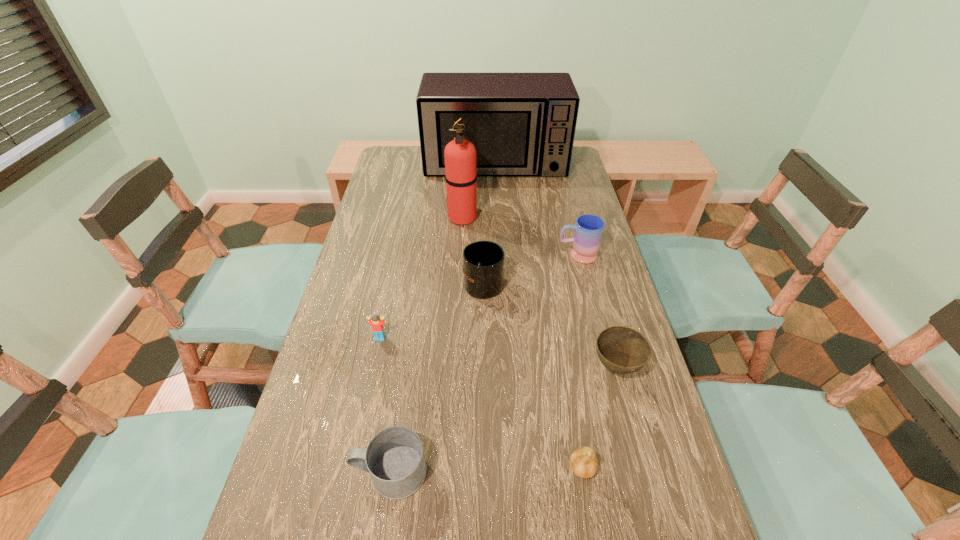
Locate an element on the screen. fire extinguisher is located at coordinates (460, 154).

This screenshot has height=540, width=960. Find the location of `the farthest object`. the farthest object is located at coordinates (522, 124).

Where is `microwave_oven`? Image resolution: width=960 pixels, height=540 pixels. microwave_oven is located at coordinates (522, 124).

Where is `the third farthest object`? The height and width of the screenshot is (540, 960). the third farthest object is located at coordinates (588, 232).

Identify the location of the farthest mug. (588, 232).

You are a GUI agent. You are given a task and a screenshot of the screen. Output one action in this format:
    pyautogui.click(x=<x>, y=<y>)
    Task: Click on the second mug from left to right
    This screenshot has width=960, height=540.
    Given the screenshot: What is the action you would take?
    pyautogui.click(x=483, y=261)

Identify the location of the fourth farthest object. (483, 261).

Find the location of a particular element. The width and height of the screenshot is (960, 540). pear is located at coordinates (584, 464).

Locate an element on the screen. the shortest mug is located at coordinates (394, 458).

At what (x,y) coordinates should I click in order to perform the action: click on the leftmost mug. Please return your answer as a coordinate pair (x, y). Looking at the image, I should click on (394, 458).